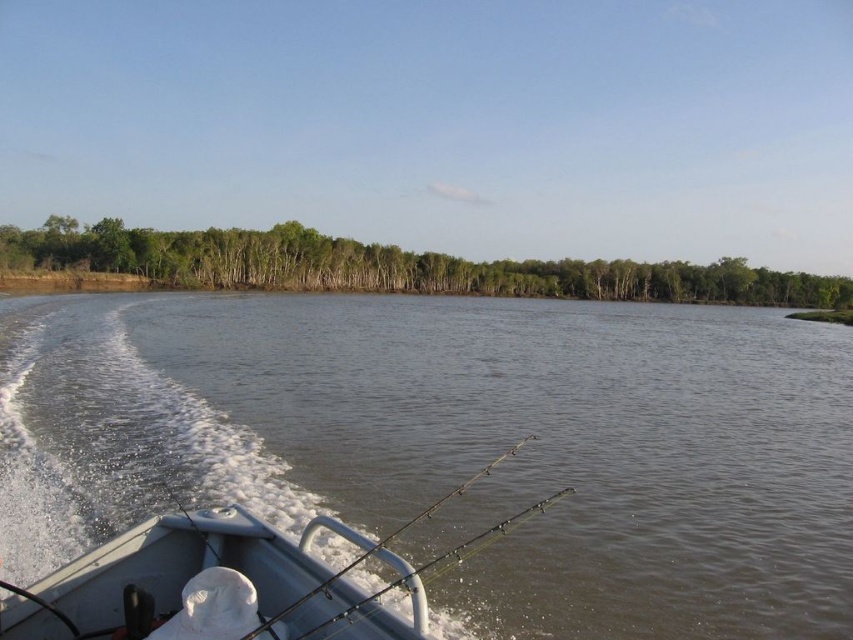
You are on a small motorboat in the middle of a wide river. You notice green leafy trees at upper center in the distance. If you want to reach those trees as quickly as possible, which direction should you head?

The green leafy trees at upper center are 264.49 feet away from the camera. To reach them as quickly as possible, you should head directly towards the green leafy trees at upper center since they are the closest trees in the scene.

You are on a motorboat and see the green leafy trees at upper center and the green metallic fishing pole at center. Which object is higher in the scene?

The green leafy trees at upper center are higher than the green metallic fishing pole at center.

In the scene shown: You are on a small motorboat and want to retrieve an object floating in the brown water at center. The object is 21.84 feet away from you. Can you reach it with a 20 feet long fishing rod extending diagonally across the frame?

The object is 21.84 feet away from you, and the fishing rod is only 20 feet long, so you cannot reach the object with the fishing rod.